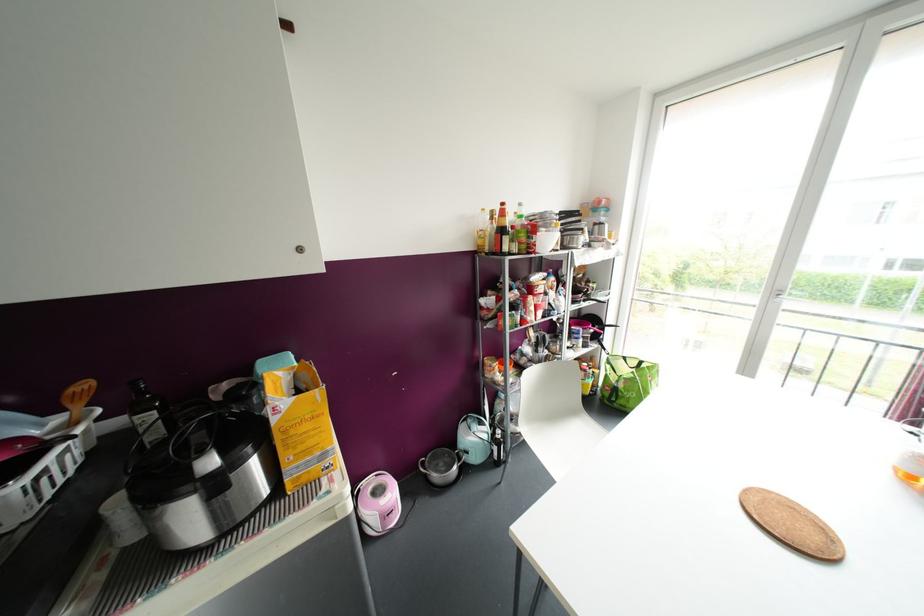
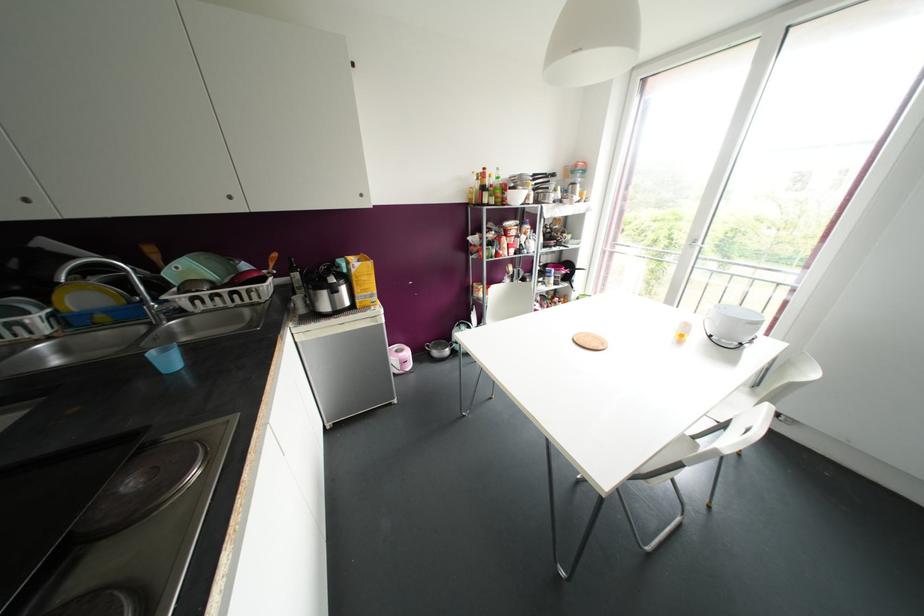
Locate, in the second image, the point that corresponds to [305,427] in the first image.

(363, 277)